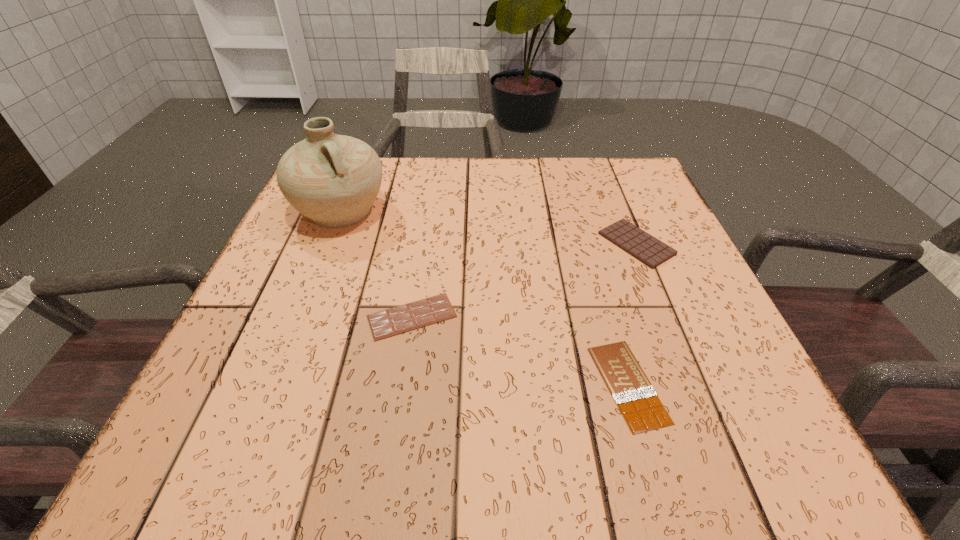
Locate an element on the screen. This screenshot has width=960, height=540. vacant space situated 0.140m on the back of the second shortest chocolate bar is located at coordinates (422, 248).

Identify the location of vacant space located 0.390m on the back of the shortest object. (579, 213).

The height and width of the screenshot is (540, 960). I want to click on object that is at the far edge, so click(332, 179).

At what (x,y) coordinates should I click in order to perform the action: click on object that is at the near edge. Please return your answer as a coordinate pair (x, y). Looking at the image, I should click on click(637, 400).

At what (x,y) coordinates should I click in order to perform the action: click on object that is at the left edge. Please return your answer as a coordinate pair (x, y). Looking at the image, I should click on (332, 179).

Where is `object present at the far left corner`? The height and width of the screenshot is (540, 960). object present at the far left corner is located at coordinates (332, 179).

The width and height of the screenshot is (960, 540). Identify the location of object located in the near right corner section of the desktop. (637, 400).

Image resolution: width=960 pixels, height=540 pixels. In the image, there is a desktop. What are the coordinates of `vacant area at the far edge` in the screenshot? It's located at (526, 185).

At what (x,y) coordinates should I click in order to perform the action: click on vacant space at the near edge. Please return your answer as a coordinate pair (x, y). The width and height of the screenshot is (960, 540). Looking at the image, I should click on (557, 448).

The height and width of the screenshot is (540, 960). In the image, there is a desktop. Find the location of `vacant region at the left edge`. vacant region at the left edge is located at coordinates (276, 289).